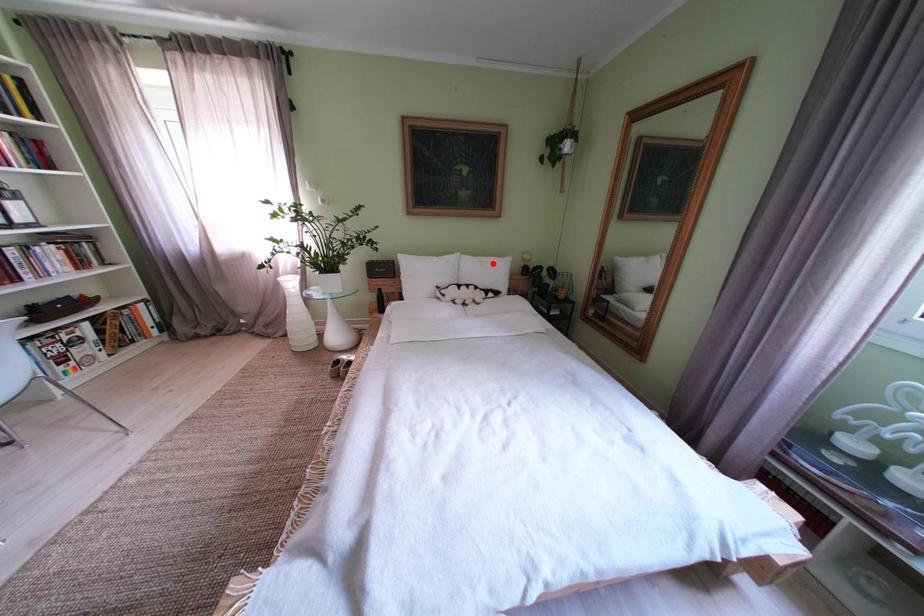
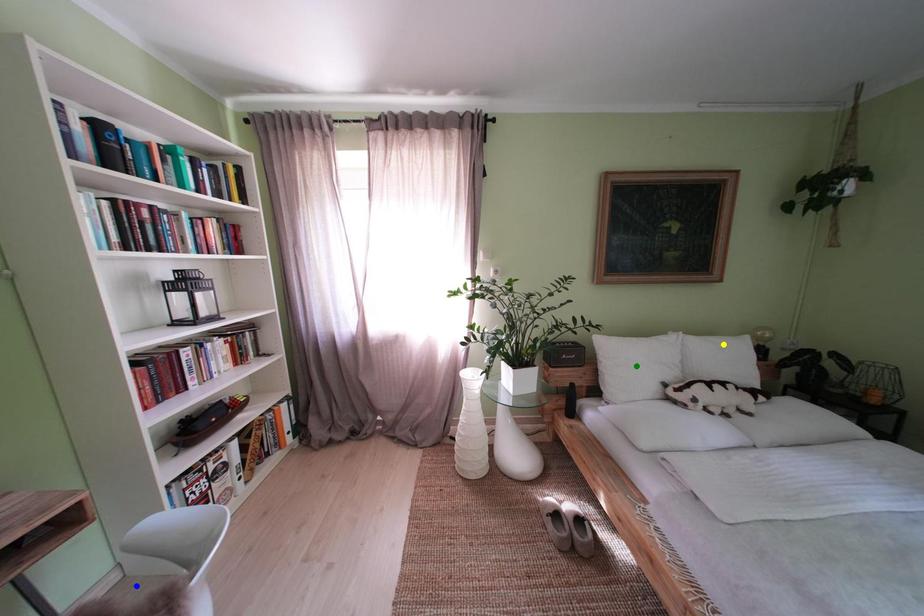
Question: I am providing you with two images of the same scene from different viewpoints. A red point is marked on the first image. You are given multiple points on the second image. Which spot in image 2 lines up with the point in image 1?

Choices:
 (A) yellow point
 (B) blue point
 (C) green point

Answer: (A)